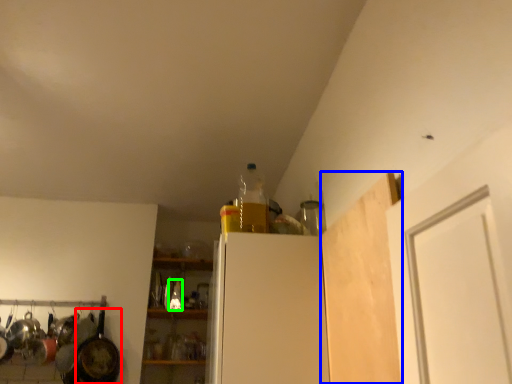
Question: Considering the real-world distances, which object is farthest from frying pan (highlighted by a red box)? plywood (highlighted by a blue box) or bottle (highlighted by a green box)?

Choices:
 (A) plywood
 (B) bottle

Answer: (A)